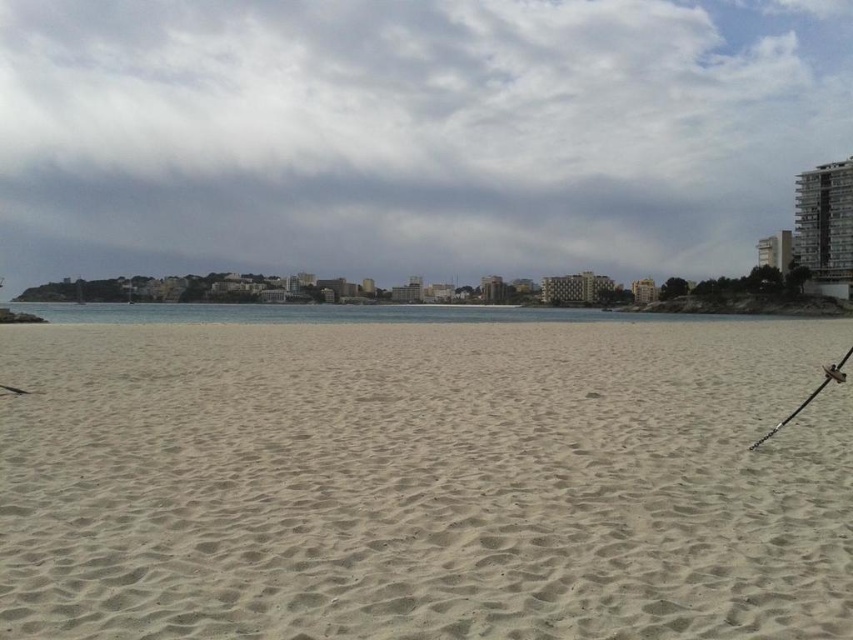
You are standing on the beach and want to walk from the metallic fishing pole at lower right to the clear water at center. Which direction should you move in?

You should move towards the clear water at center because it is closer to you than the metallic fishing pole at lower right.